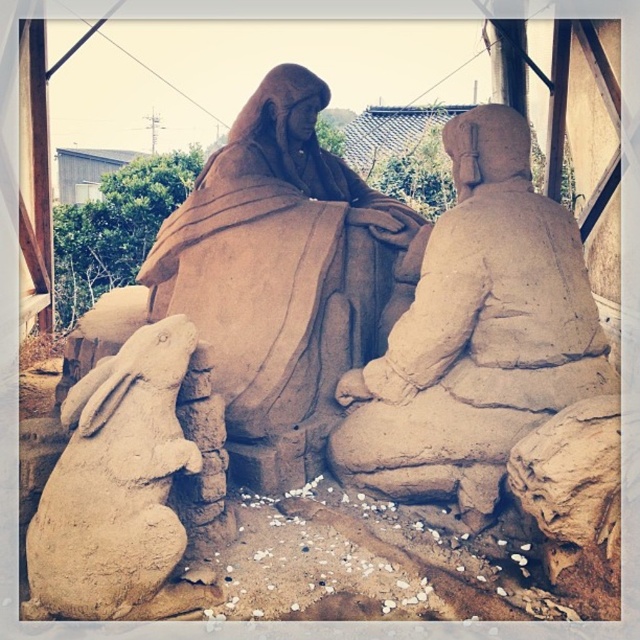
You are an artist trying to place a new sculpture between the matte clay figure at center and the smooth beige rabbit at lower left. Which direction should you move to ensure the new sculpture is placed between them?

The matte clay figure at center is taller than the smooth beige rabbit at lower left. To place the new sculpture between them, move towards the lower left direction from the matte clay figure at center, as the rabbit is positioned lower and to the left.

You are an artist trying to place a new sand sculpture between the matte clay figure at center and the smooth beige rabbit at lower left. Given their sizes, which one should you position closer to the front to maintain balance?

The matte clay figure at center is larger in size than the smooth beige rabbit at lower left, so to maintain balance, you should position the smaller smooth beige rabbit at lower left closer to the front.